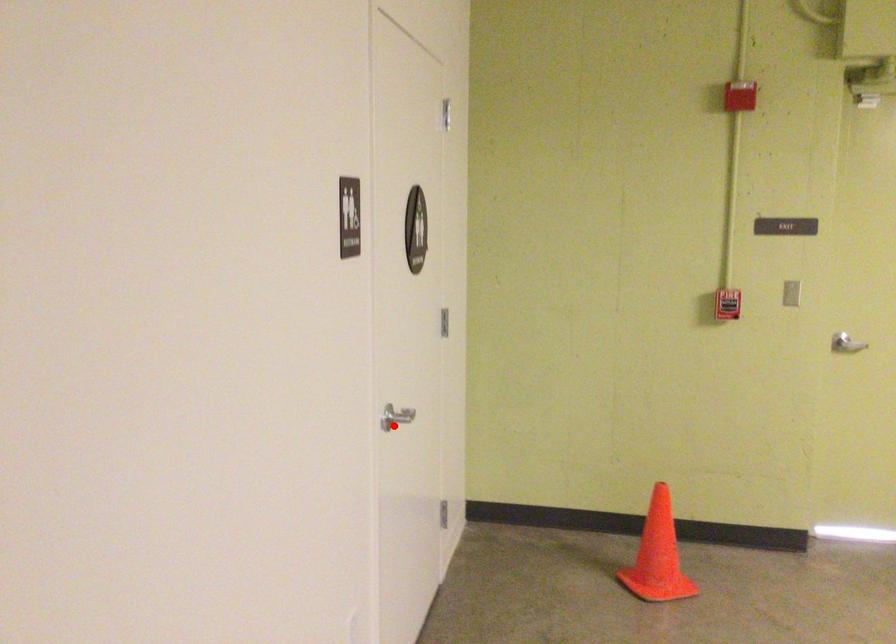
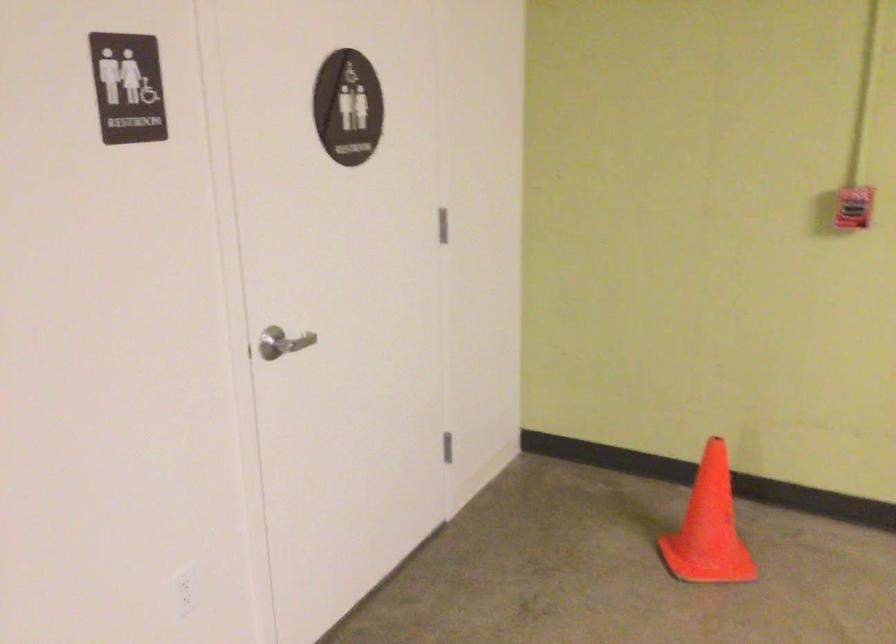
In the second image, find the point that corresponds to the highlighted location in the first image.

(281, 343)